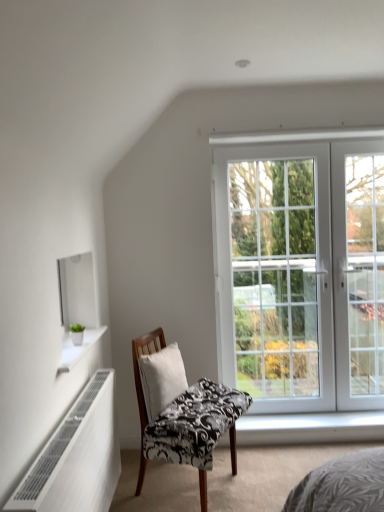
Locate an element on the screen. vacant area that is situated to the right of black and white patterned chair at center is located at coordinates (262, 479).